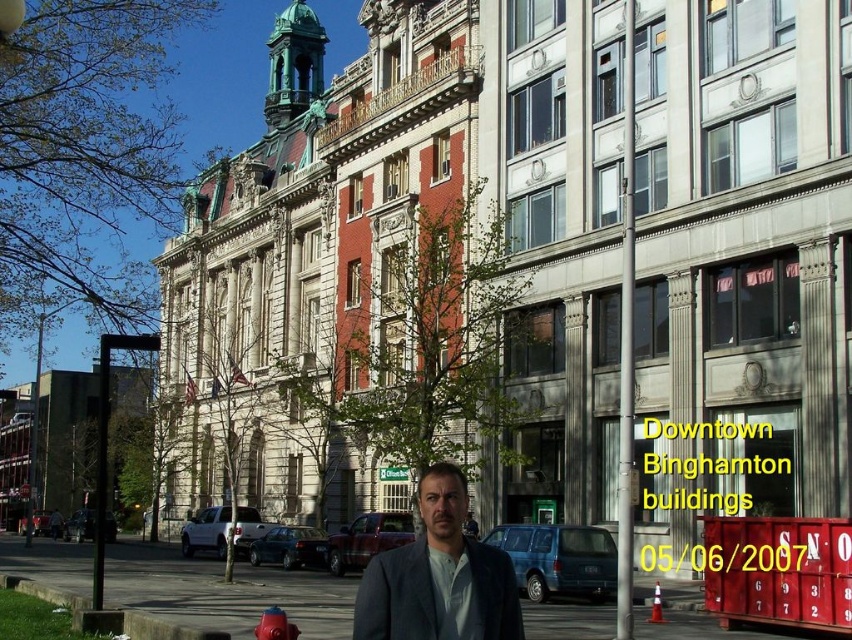
You are standing on the gray asphalt pavement at lower center and want to reach the matte gray suit at center. Which direction should you move to get there?

The gray asphalt pavement at lower center is to the left of the matte gray suit at center, so you should move to the right to reach it.

You are a delivery person standing at the red matte fire hydrant at lower center, and you need to deliver a package to the matte gray suit at center. The delivery robot you are using has a maximum range of 5 meters. Can the robot make the delivery without needing a recharge?

The distance between the matte gray suit at center and the red matte fire hydrant at lower center is 7.52 meters, which exceeds the robot maximum range of 5 meters. The robot cannot make the delivery without needing a recharge.

You are a pedestrian standing on the street in Binghamton. You see a matte gray suit at center and a red matte fire hydrant at lower center. Which object is higher up in the image?

The matte gray suit at center is above the red matte fire hydrant at lower center in the image.